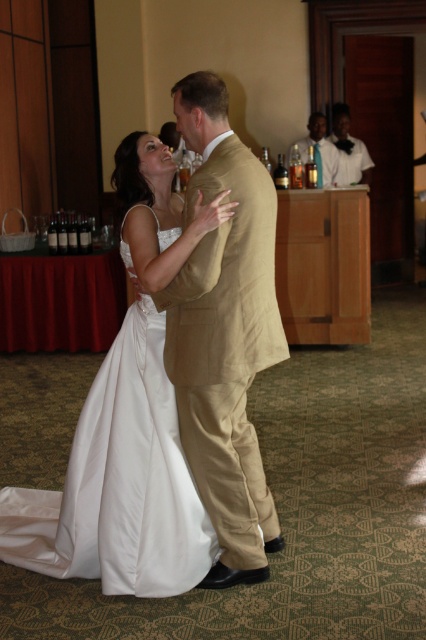
Is satin white dress at center above tan fabric suit at center?

No.

What do you see at coordinates (118, 483) in the screenshot? I see `satin white dress at center` at bounding box center [118, 483].

The image size is (426, 640). What do you see at coordinates (118, 483) in the screenshot?
I see `satin white dress at center` at bounding box center [118, 483].

Locate an element on the screen. satin white dress at center is located at coordinates (118, 483).

Can you confirm if satin white dress at center is thinner than matte gold suit at upper center?

In fact, satin white dress at center might be wider than matte gold suit at upper center.

Is satin white dress at center below matte gold suit at upper center?

Yes, satin white dress at center is below matte gold suit at upper center.

Where is `satin white dress at center`? This screenshot has width=426, height=640. satin white dress at center is located at coordinates (118, 483).

Image resolution: width=426 pixels, height=640 pixels. Identify the location of tan fabric suit at center. (224, 333).

Does tan fabric suit at center have a smaller size compared to matte gold suit at upper center?

Yes, tan fabric suit at center is smaller than matte gold suit at upper center.

At what (x,y) coordinates should I click in order to perform the action: click on tan fabric suit at center. Please return your answer as a coordinate pair (x, y). The height and width of the screenshot is (640, 426). Looking at the image, I should click on (224, 333).